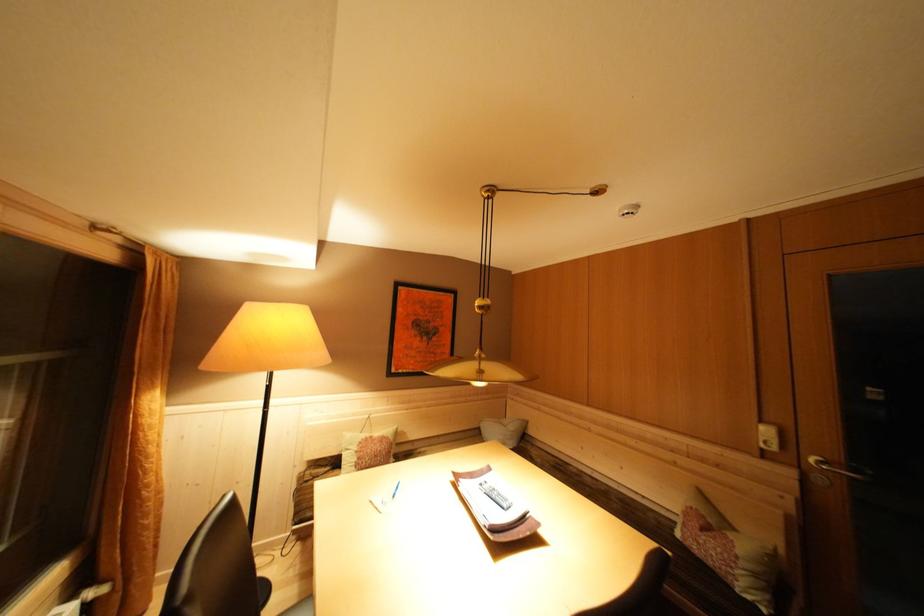
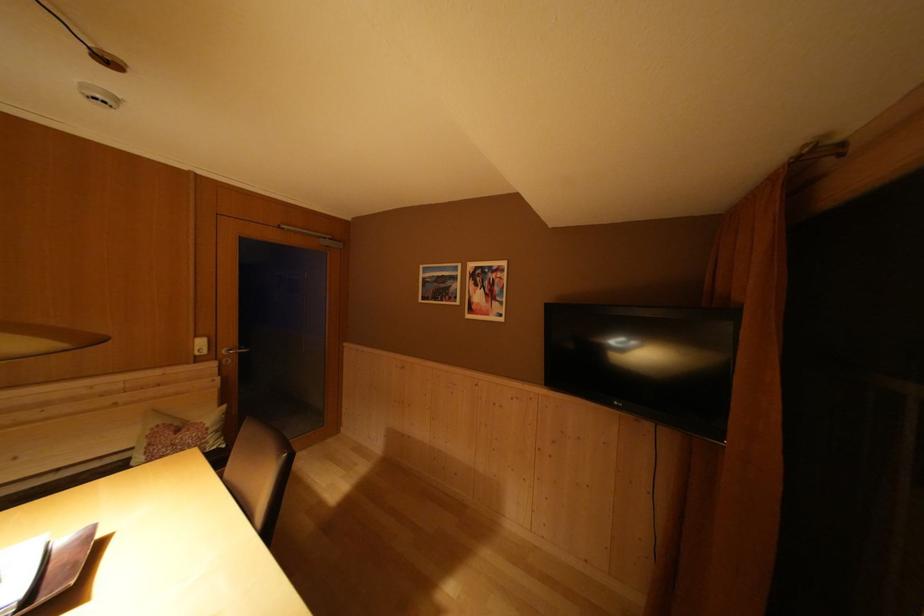
Locate, in the second image, the point that corresponds to (x=768, y=427) in the first image.

(203, 342)